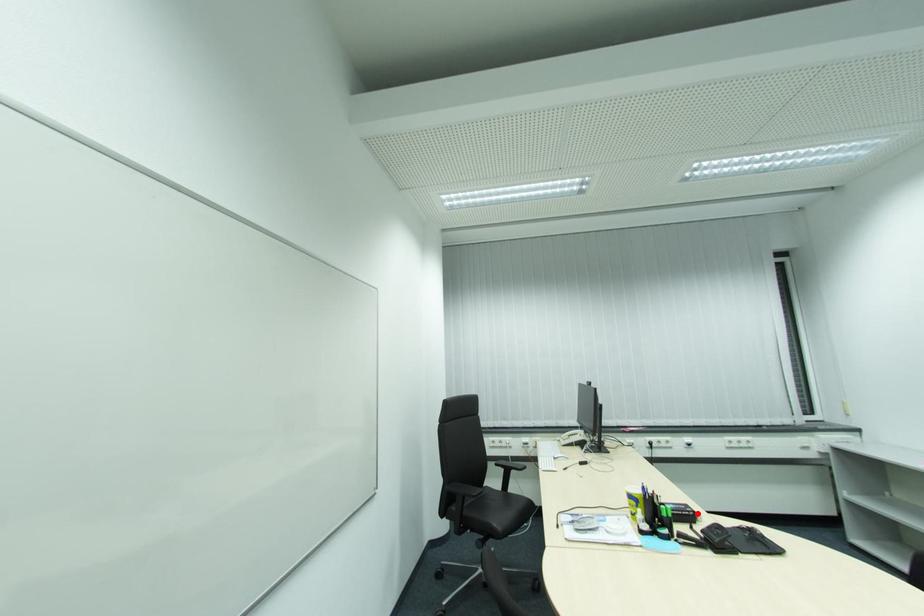
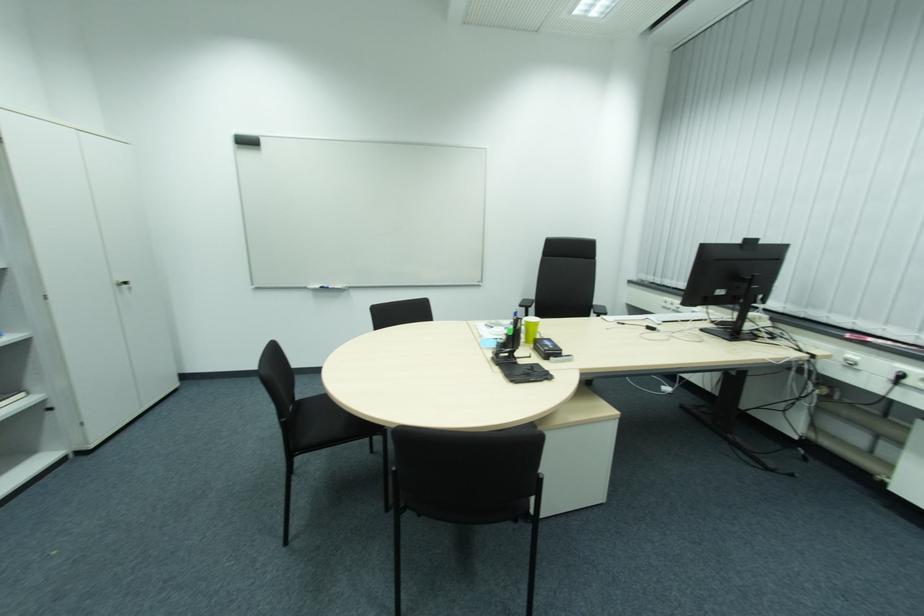
The point at the highlighted location is marked in the first image. Where is the corresponding point in the second image?

(550, 351)